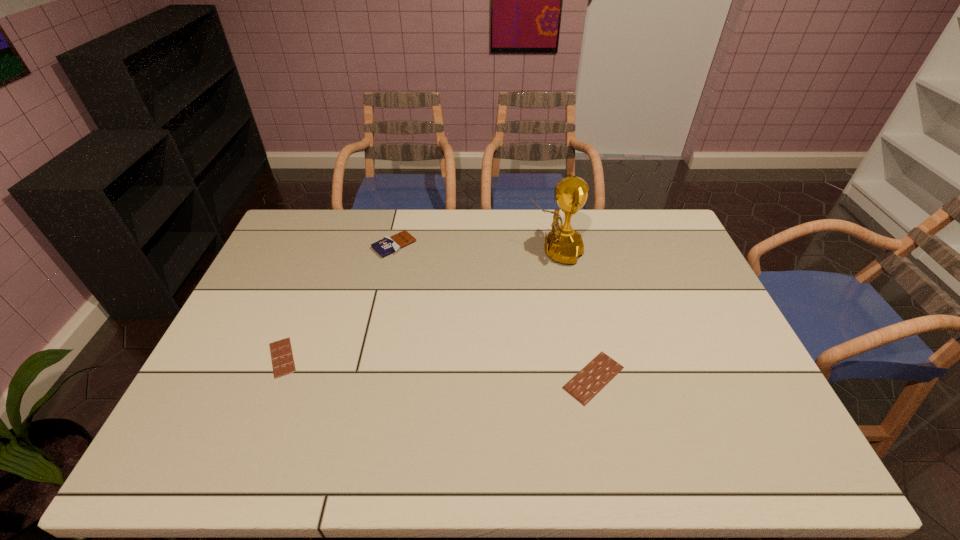
Where is `the closest object to the tallest chocolate bar`? Image resolution: width=960 pixels, height=540 pixels. the closest object to the tallest chocolate bar is located at coordinates (282, 358).

Locate an element on the screen. the closest object to the leftmost chocolate bar is located at coordinates (387, 245).

Identify the location of chocolate bar that stands as the closest to the second shortest chocolate bar. 387,245.

Choose which chocolate bar is the second nearest neighbor to the third tallest object. Please provide its 2D coordinates. Your answer should be formatted as a tuple, i.e. [(x, y)], where the tuple contains the x and y coordinates of a point satisfying the conditions above.

[(282, 358)]

Find the location of a particular element. Image resolution: width=960 pixels, height=540 pixels. free region that satisfies the following two spatial constraints: 1. on the back side of the third object from right to left; 2. on the left side of the leftmost chocolate bar is located at coordinates (327, 245).

This screenshot has height=540, width=960. What are the coordinates of `free location that satisfies the following two spatial constraints: 1. on the front side of the rightmost chocolate bar; 2. on the right side of the tallest object` in the screenshot? It's located at (580, 377).

At what (x,y) coordinates should I click in order to perform the action: click on free space that satisfies the following two spatial constraints: 1. on the front side of the award; 2. on the right side of the rightmost chocolate bar. Please return your answer as a coordinate pair (x, y). Looking at the image, I should click on (580, 377).

Where is `vacant space that satisfies the following two spatial constraints: 1. on the front side of the second shortest chocolate bar; 2. on the left side of the tallest object`? vacant space that satisfies the following two spatial constraints: 1. on the front side of the second shortest chocolate bar; 2. on the left side of the tallest object is located at coordinates (580, 377).